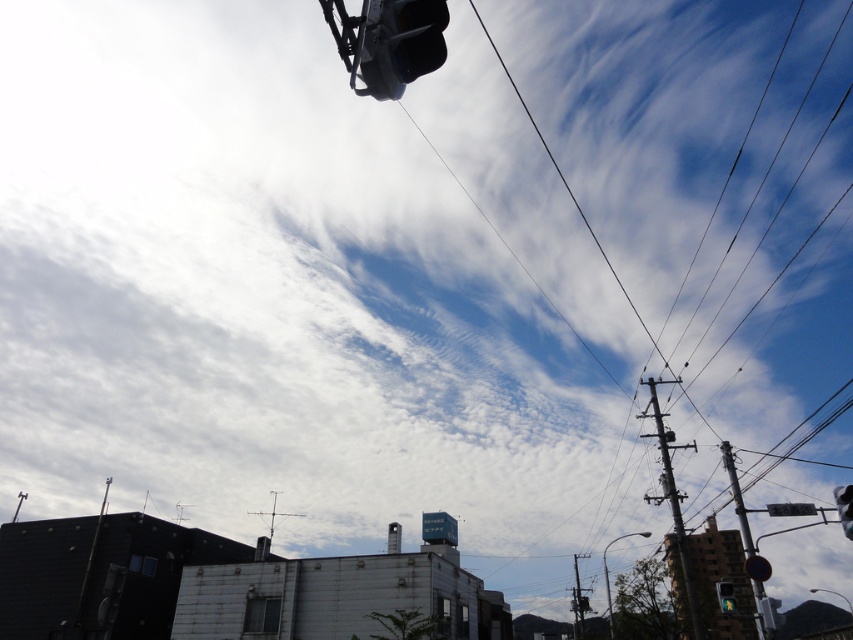
Is metallic pole at right positioned in front of metallic silver traffic light at upper right?

No, metallic pole at right is further to the viewer.

Between point (746, 524) and point (850, 504), which one is positioned behind?

Point (746, 524)

Identify the location of metallic pole at right. The image size is (853, 640). click(737, 497).

Who is more distant from viewer, (405, 74) or (733, 608)?

The point (733, 608) is behind.

I want to click on black plastic traffic light at upper center, so click(397, 44).

Which is in front, point (363, 20) or point (666, 477)?

Point (363, 20) is more forward.

Can you confirm if black plastic traffic light at upper center is taller than metallic gray pole at right?

Incorrect, black plastic traffic light at upper center's height is not larger of metallic gray pole at right's.

You are a GUI agent. You are given a task and a screenshot of the screen. Output one action in this format:
    pyautogui.click(x=<x>, y=<y>)
    Task: Click on the black plastic traffic light at upper center
    The width and height of the screenshot is (853, 640).
    Given the screenshot: What is the action you would take?
    pyautogui.click(x=397, y=44)